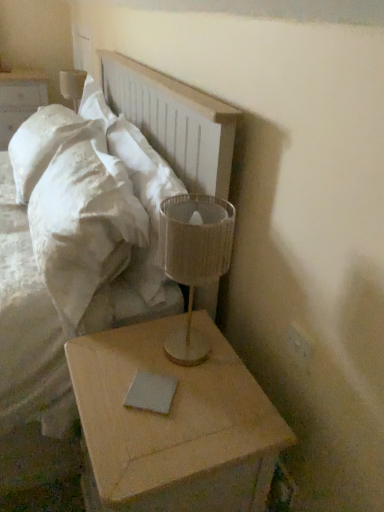
You are a GUI agent. You are given a task and a screenshot of the screen. Output one action in this format:
    pyautogui.click(x=<x>, y=<y>)
    Task: Click on the vacant space that's between translucent fabric lampshade at right, which is counted as the 1th table lamp, starting from the front, and gray matte notepad at lower center
    
    Given the screenshot: What is the action you would take?
    pyautogui.click(x=177, y=374)